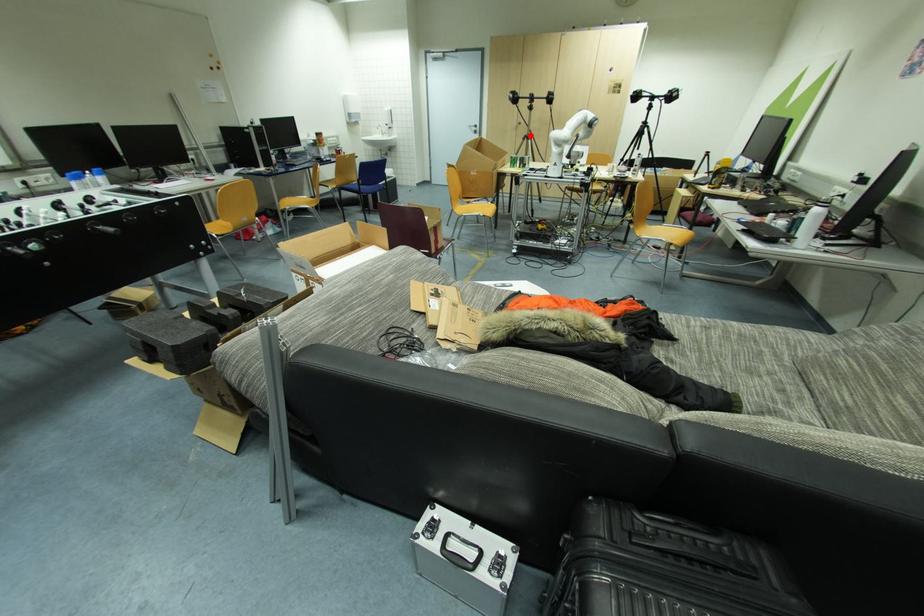
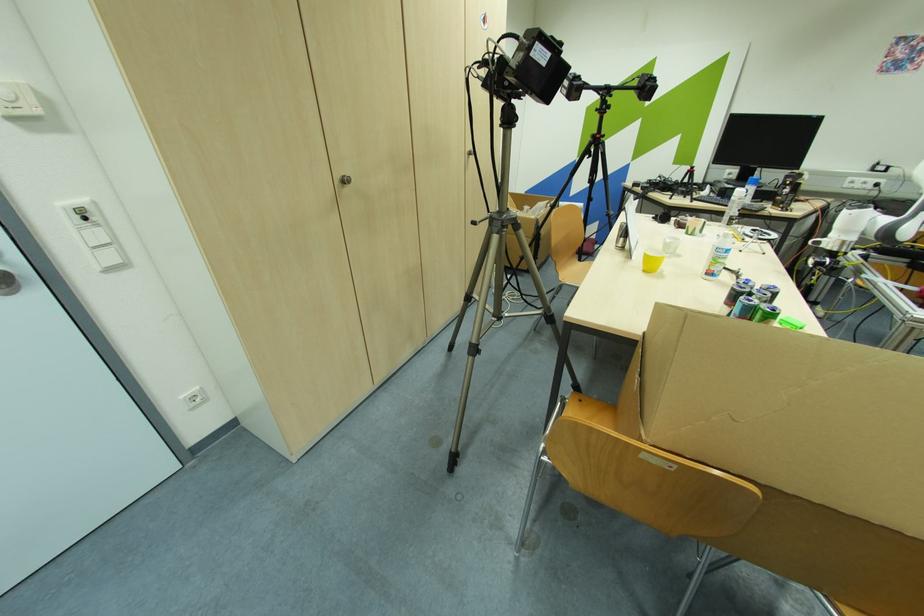
Question: I am providing you with two images of the same scene from different viewpoints. A red point is shown in image1. For the corresponding object point in image2, is it positioned nearer or farther from the camera?

Choices:
 (A) Nearer
 (B) Farther

Answer: (B)